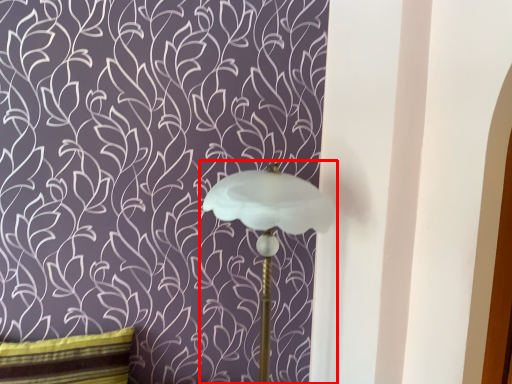
Question: From the image's perspective, considering the relative positions of lamp (annotated by the red box) and pillow in the image provided, where is lamp (annotated by the red box) located with respect to the staircase?

Choices:
 (A) below
 (B) above

Answer: (B)